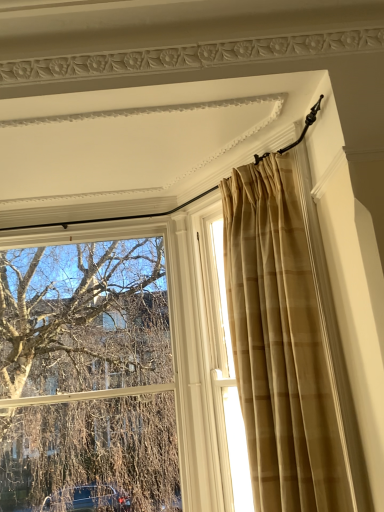
Question: Is beige textured curtain at right, the 2th window viewed from the left, oriented towards beige plaid curtain at upper right?

Choices:
 (A) yes
 (B) no

Answer: (B)

Question: From a real-world perspective, is beige textured curtain at right, the 2th window viewed from the left, positioned over beige plaid curtain at upper right based on gravity?

Choices:
 (A) yes
 (B) no

Answer: (B)

Question: From the image's perspective, is beige textured curtain at right, which is counted as the first window, starting from the right, below beige plaid curtain at upper right?

Choices:
 (A) no
 (B) yes

Answer: (B)

Question: Is beige textured curtain at right, the 2th window viewed from the left, oriented away from beige plaid curtain at upper right?

Choices:
 (A) yes
 (B) no

Answer: (B)

Question: Are beige textured curtain at right, which is counted as the first window, starting from the right, and beige plaid curtain at upper right far apart?

Choices:
 (A) no
 (B) yes

Answer: (A)

Question: Considering the relative positions of beige textured curtain at right, the 2th window viewed from the left, and beige plaid curtain at upper right in the image provided, is beige textured curtain at right, the 2th window viewed from the left, to the right of beige plaid curtain at upper right from the viewer's perspective?

Choices:
 (A) no
 (B) yes

Answer: (A)

Question: Considering the relative sizes of clear glass window at upper left, the second window when ordered from right to left, and beige plaid curtain at upper right in the image provided, is clear glass window at upper left, the second window when ordered from right to left, taller than beige plaid curtain at upper right?

Choices:
 (A) no
 (B) yes

Answer: (B)

Question: From the image's perspective, is clear glass window at upper left, placed as the first window when sorted from left to right, beneath beige plaid curtain at upper right?

Choices:
 (A) yes
 (B) no

Answer: (A)

Question: Is clear glass window at upper left, the second window when ordered from right to left, not within beige plaid curtain at upper right?

Choices:
 (A) no
 (B) yes

Answer: (B)

Question: Can you confirm if clear glass window at upper left, the second window when ordered from right to left, is shorter than beige plaid curtain at upper right?

Choices:
 (A) yes
 (B) no

Answer: (B)

Question: Considering the relative positions of clear glass window at upper left, placed as the first window when sorted from left to right, and beige plaid curtain at upper right in the image provided, is clear glass window at upper left, placed as the first window when sorted from left to right, behind beige plaid curtain at upper right?

Choices:
 (A) no
 (B) yes

Answer: (B)

Question: Is clear glass window at upper left, placed as the first window when sorted from left to right, far from beige plaid curtain at upper right?

Choices:
 (A) no
 (B) yes

Answer: (B)

Question: Is beige textured curtain at right, the 2th window viewed from the left, oriented away from clear glass window at upper left, the second window when ordered from right to left?

Choices:
 (A) no
 (B) yes

Answer: (A)